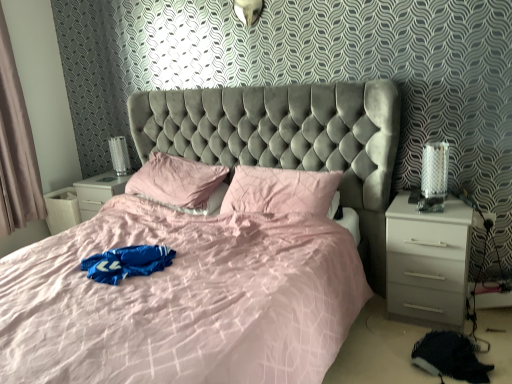
Question: Is light beige fabric curtain at left wider or thinner than black fuzzy blanket at lower right?

Choices:
 (A) wide
 (B) thin

Answer: (B)

Question: Is light beige fabric curtain at left situated inside black fuzzy blanket at lower right or outside?

Choices:
 (A) inside
 (B) outside

Answer: (B)

Question: Estimate the real-world distances between objects in this image. Which object is farther from the velvet grey bed at center?

Choices:
 (A) metallic silver table lamp at left, the 1th table lamp from the back
 (B) metallic silver table lamp at right, the 1th table lamp in the front-to-back sequence
 (C) pink fabric pillow at center
 (D) light beige fabric curtain at left
 (E) black fuzzy blanket at lower right

Answer: (D)

Question: Which is farther from the black fuzzy blanket at lower right?

Choices:
 (A) metallic silver table lamp at left, the 1th table lamp from the back
 (B) white glossy nightstand at right
 (C) metallic silver table lamp at right, which appears as the second table lamp when viewed from the left
 (D) velvet grey bed at center
 (E) light beige fabric curtain at left

Answer: (E)